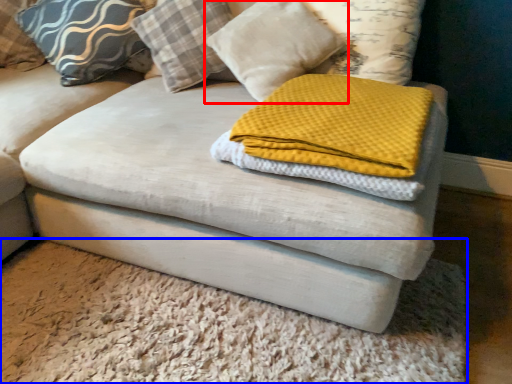
Question: Which object appears farthest to the camera in this image, pillow (highlighted by a red box) or mat (highlighted by a blue box)?

Choices:
 (A) pillow
 (B) mat

Answer: (A)